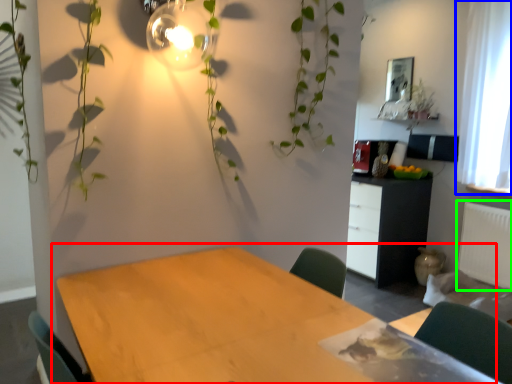
Question: Which object is positioned closest to table (highlighted by a red box)? Select from curtain (highlighted by a blue box) and radiator (highlighted by a green box).

Choices:
 (A) curtain
 (B) radiator

Answer: (B)